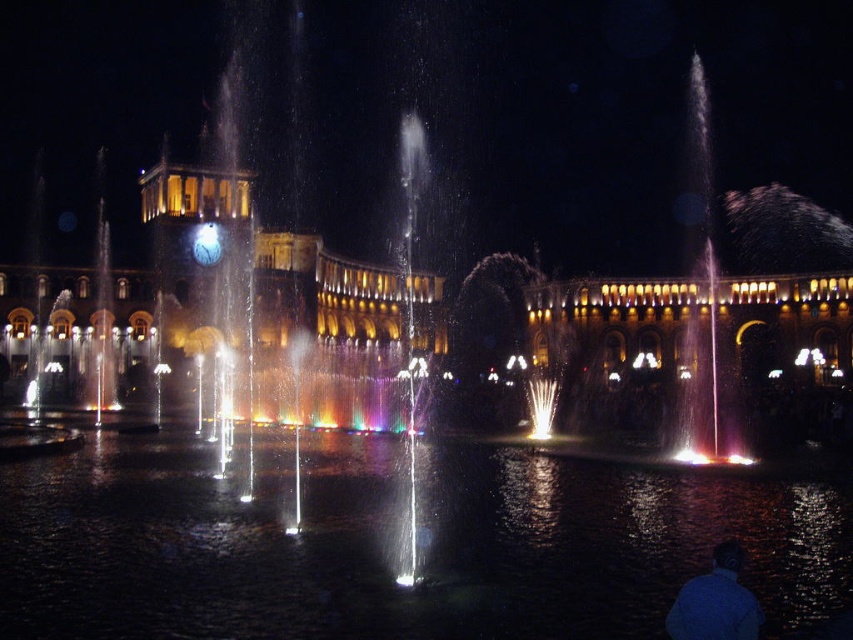
Question: Does clear liquid water at center appear on the left side of translucent glass water at right?

Choices:
 (A) yes
 (B) no

Answer: (A)

Question: Which object is closer to the camera taking this photo?

Choices:
 (A) blue matte shirt at lower right
 (B) translucent glass water at right
 (C) clear liquid water at center

Answer: (A)

Question: Does translucent glass water at right have a greater width compared to blue matte shirt at lower right?

Choices:
 (A) no
 (B) yes

Answer: (B)

Question: Which object is farther from the camera taking this photo?

Choices:
 (A) clear liquid water at center
 (B) blue matte shirt at lower right
 (C) translucent glass water at right

Answer: (C)

Question: Which point is farther to the camera?

Choices:
 (A) (457, 477)
 (B) (752, 621)

Answer: (A)

Question: Does clear liquid water at center appear on the left side of translucent glass water at right?

Choices:
 (A) yes
 (B) no

Answer: (A)